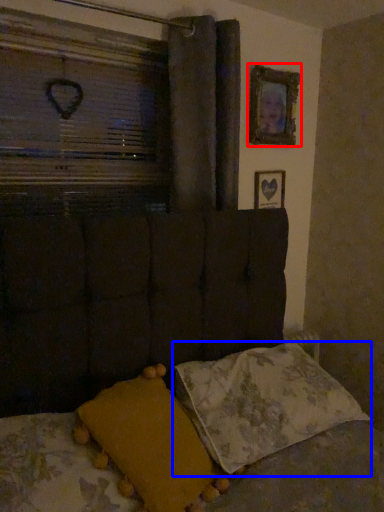
Question: Which point is further to the camera, picture frame (highlighted by a red box) or pillow (highlighted by a blue box)?

Choices:
 (A) picture frame
 (B) pillow

Answer: (A)